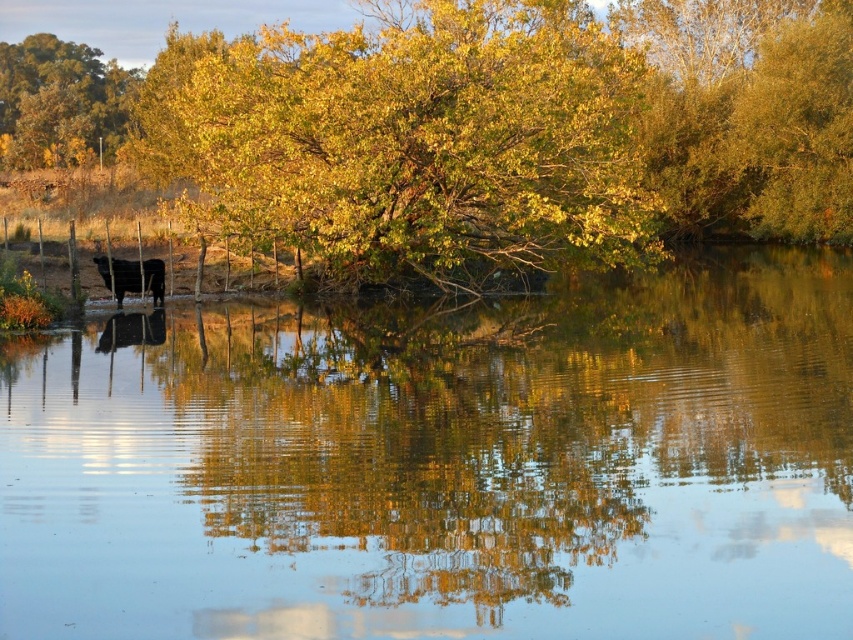
This screenshot has width=853, height=640. What do you see at coordinates (442, 464) in the screenshot? I see `clear water at center` at bounding box center [442, 464].

Is clear water at center shorter than golden leafy tree at upper left?

Indeed, clear water at center has a lesser height compared to golden leafy tree at upper left.

Locate an element on the screen. The height and width of the screenshot is (640, 853). clear water at center is located at coordinates (442, 464).

Can you confirm if golden leafy tree at upper left is thinner than black glossy cow at left?

In fact, golden leafy tree at upper left might be wider than black glossy cow at left.

What are the coordinates of `golden leafy tree at upper left` in the screenshot? It's located at (61, 102).

Is point (178, 580) more distant than point (132, 268)?

No, (178, 580) is closer to viewer.

Does clear water at center appear under black glossy cow at left?

Yes.

Is point (386, 525) positioned behind point (161, 260)?

No, it is not.

Identify the location of clear water at center. This screenshot has width=853, height=640. (442, 464).